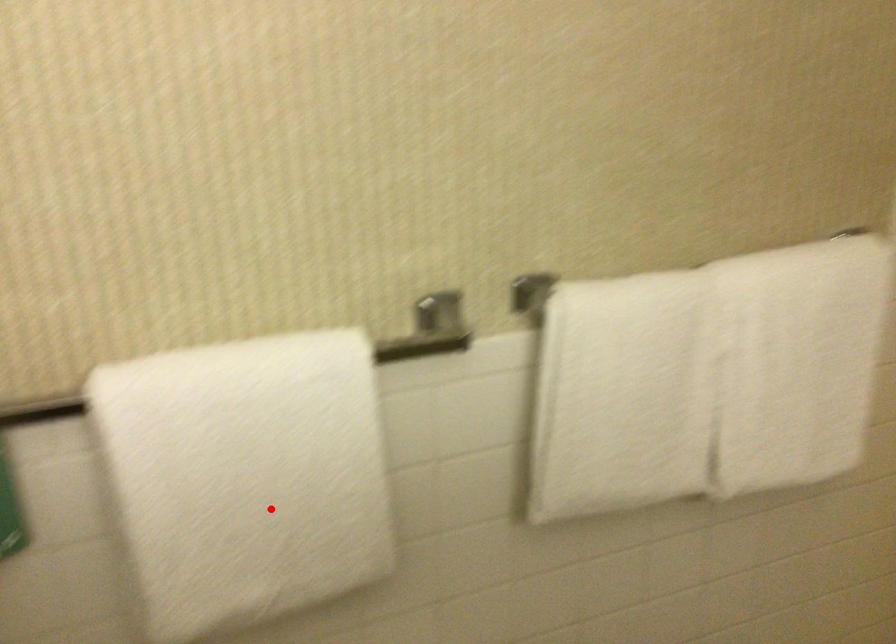
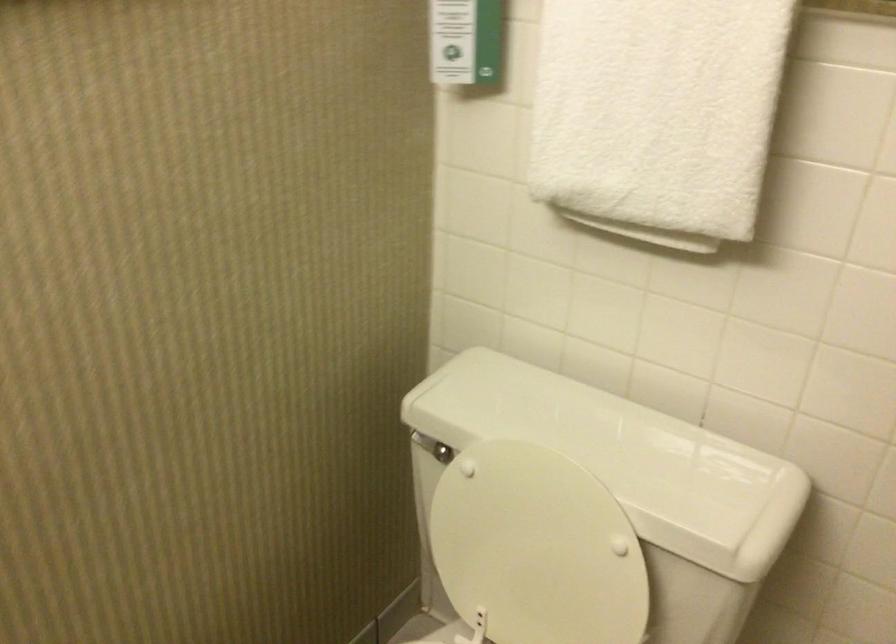
In the second image, find the point that corresponds to the highlighted location in the first image.

(657, 114)